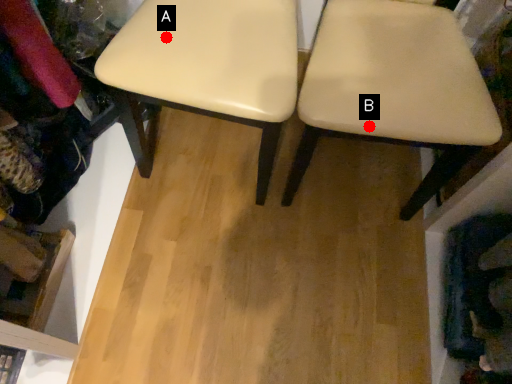
Question: Two points are circled on the image, labeled by A and B beside each circle. Which point is closer to the camera?

Choices:
 (A) A is closer
 (B) B is closer

Answer: (B)